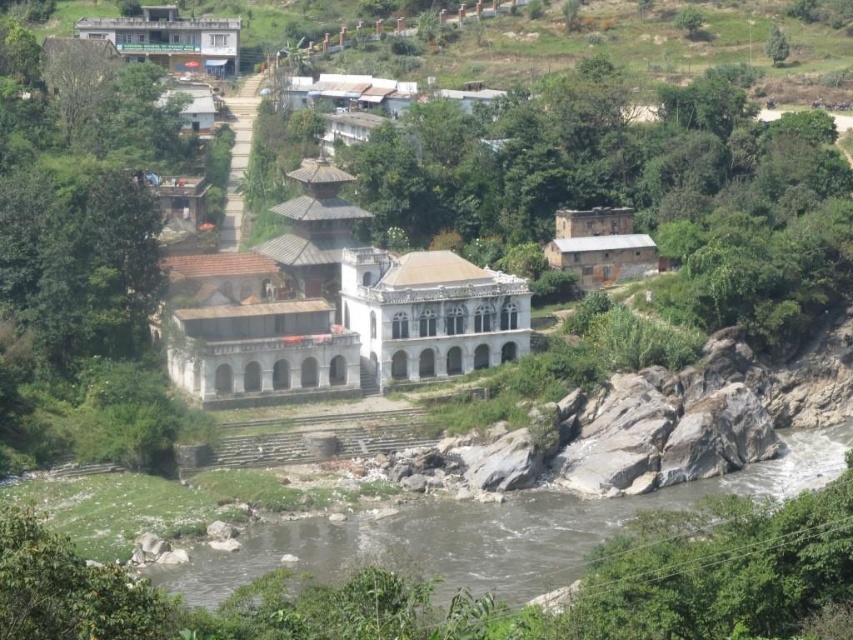
From the picture: You are standing at the top of the slope near the brown stone building at upper right and want to get to the brown rocky river at lower center. Which direction should you head towards?

Result: You should head to the left since the brown rocky river at lower center is positioned on the left side of the brown stone building at upper right.

You are standing at the point closer to the camera in the image. Which point are you at, point (447,369) or point (216,77)?

You are at point (447,369) because it is closer to the camera than point (216,77).